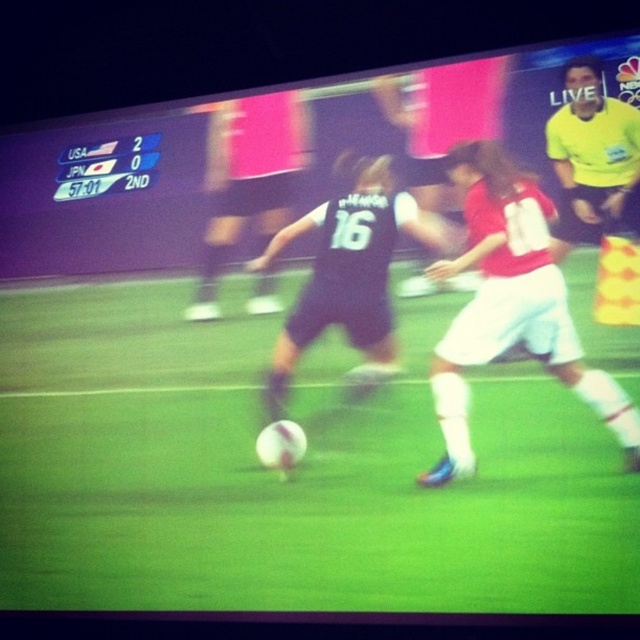
Does point (612, 454) lie behind point (234, 157)?

No, (612, 454) is closer to viewer.

Between point (230, 424) and point (218, 205), which one is positioned behind?

The point (218, 205) is more distant.

Identify the location of green grass football field at center. (294, 472).

In the scene shown: Is black matte soccer player at center bigger than yellow/yellowish-green jersey at upper right?

Yes.

Is point (248, 188) positioned in front of point (612, 134)?

No.

Measure the distance between point (268, 227) and camera.

Point (268, 227) and camera are 3.41 meters apart.

You are a GUI agent. You are given a task and a screenshot of the screen. Output one action in this format:
    pyautogui.click(x=<x>, y=<y>)
    Task: Click on the black matte soccer player at center
    
    Given the screenshot: What is the action you would take?
    (248, 179)

Is green grass football field at center above yellow/yellowish-green jersey at upper right?

No, green grass football field at center is not above yellow/yellowish-green jersey at upper right.

Who is more distant from viewer, (x=612, y=528) or (x=564, y=218)?

The point (x=564, y=218) is behind.

Between point (580, 468) and point (600, 112), which one is positioned in front?

Point (580, 468) is in front.

Locate an element on the screen. The image size is (640, 640). green grass football field at center is located at coordinates (294, 472).